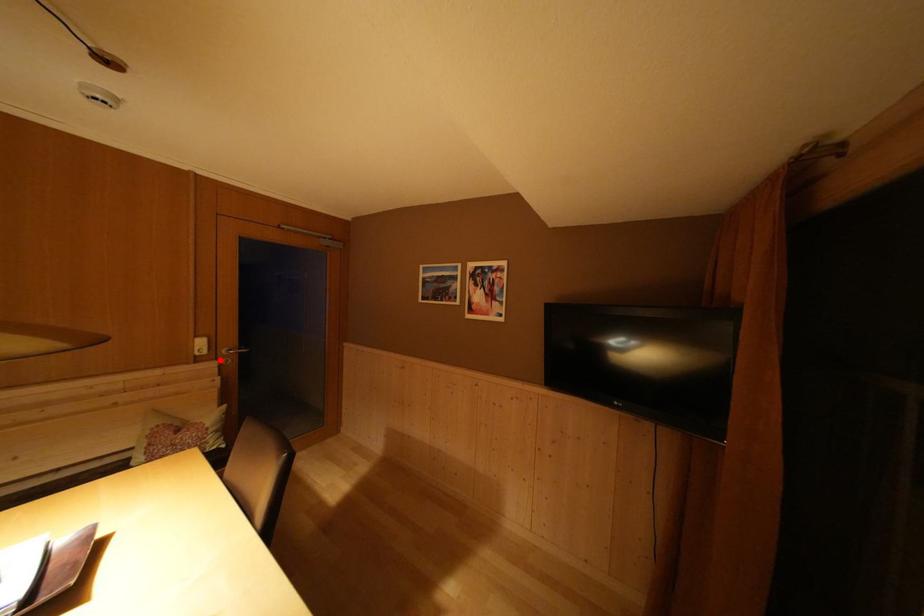
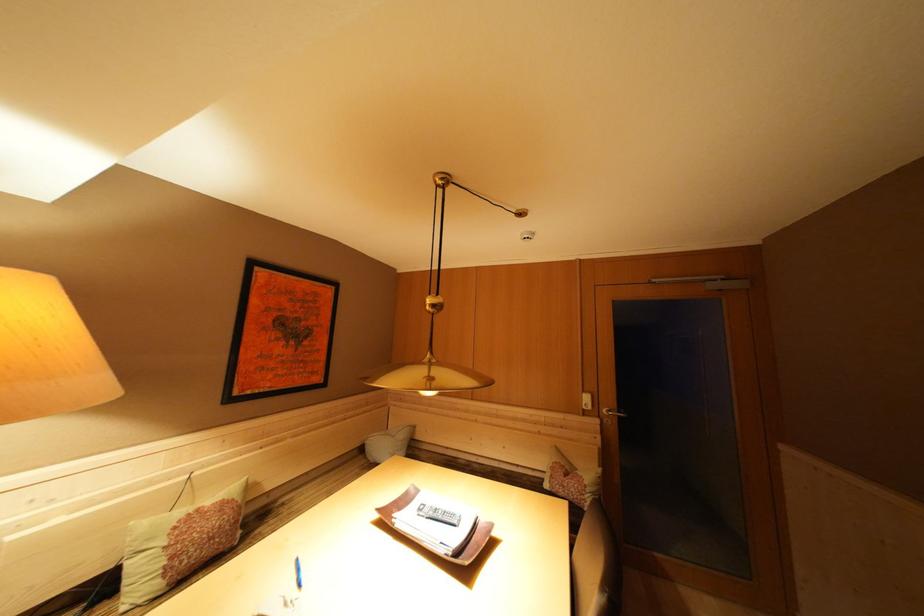
Locate, in the second image, the point that corresponds to the highlighted location in the first image.

(602, 418)